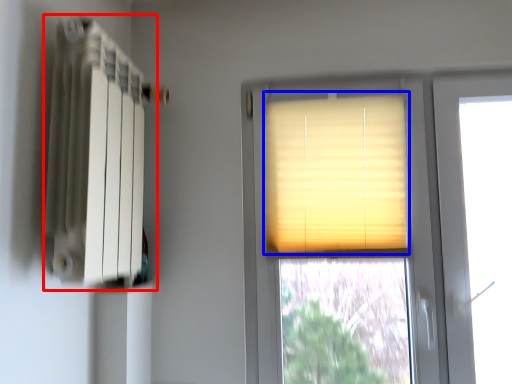
Question: Among these objects, which one is nearest to the camera, radiator (highlighted by a red box) or window blind (highlighted by a blue box)?

Choices:
 (A) radiator
 (B) window blind

Answer: (A)